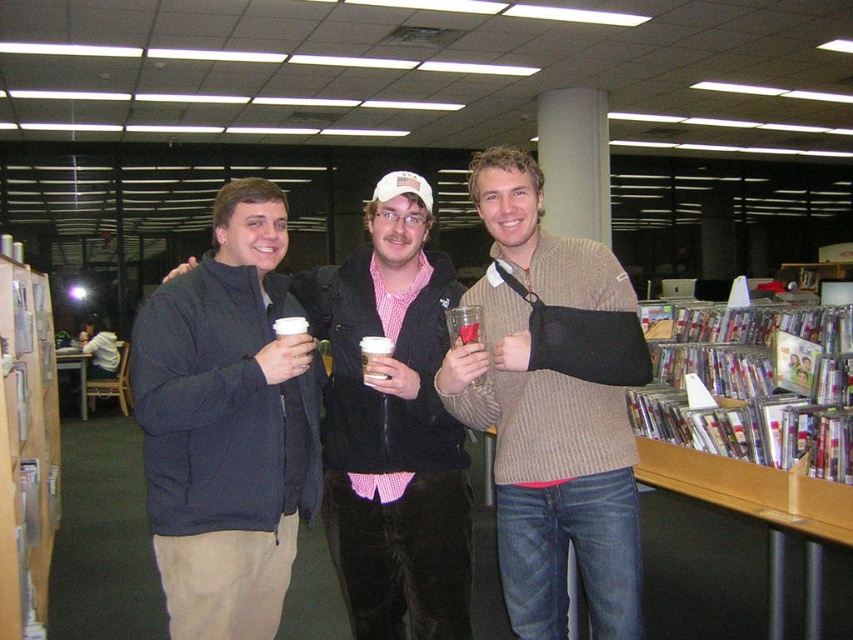
Question: Does dark blue fleece jacket at left appear under knit sweater at center?

Choices:
 (A) no
 (B) yes

Answer: (B)

Question: In this image, where is knit sweater at center located relative to dark blue jacket at center?

Choices:
 (A) right
 (B) left

Answer: (A)

Question: Among these points, which one is farthest from the camera?

Choices:
 (A) (476, 352)
 (B) (381, 472)
 (C) (263, 323)

Answer: (B)

Question: From the image, what is the correct spatial relationship of dark blue fleece jacket at left in relation to dark blue jacket at center?

Choices:
 (A) left
 (B) right

Answer: (A)

Question: Which of the following is the closest to the observer?

Choices:
 (A) (173, 556)
 (B) (351, 566)

Answer: (A)

Question: Which point is farther to the camera?

Choices:
 (A) (589, 605)
 (B) (469, 557)

Answer: (B)